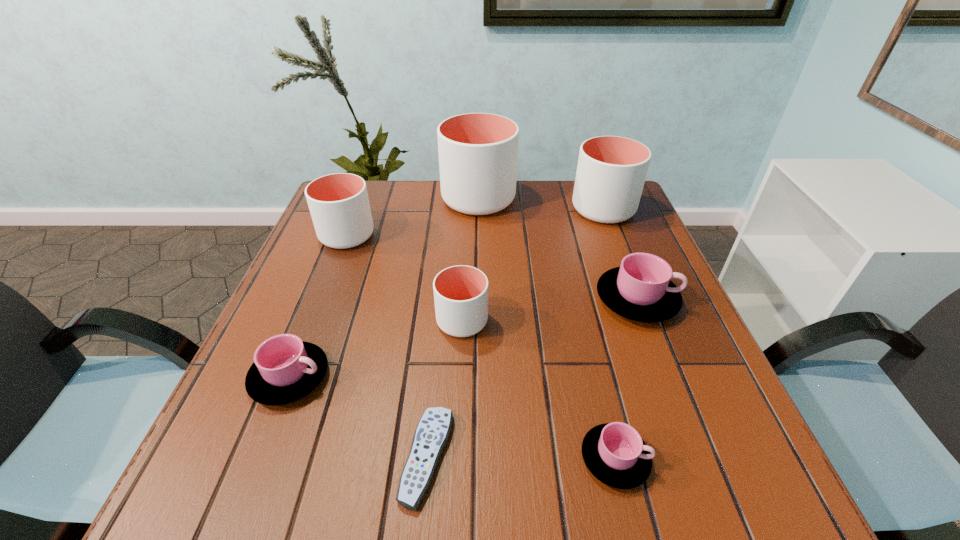
I want to click on free space located 0.080m on the side with the handle of the nearest cup, so click(699, 458).

You are a GUI agent. You are given a task and a screenshot of the screen. Output one action in this format:
    pyautogui.click(x=<x>, y=<y>)
    Task: Click on the free location located 0.260m on the right of the shortest object
    The height and width of the screenshot is (540, 960).
    Given the screenshot: What is the action you would take?
    614,457

Locate an element on the screen. The image size is (960, 540). cup that is at the near edge is located at coordinates (615, 453).

Identify the location of remote control that is at the near edge. (431, 435).

Where is `object located at the far left corner`? Image resolution: width=960 pixels, height=540 pixels. object located at the far left corner is located at coordinates (339, 205).

Where is `object that is at the far right corner`? object that is at the far right corner is located at coordinates (611, 171).

I want to click on free space at the far edge of the desktop, so click(x=431, y=188).

I want to click on vacant area at the near edge, so click(352, 501).

Find the location of `free region at the left edge`. free region at the left edge is located at coordinates (x=293, y=308).

The height and width of the screenshot is (540, 960). Identify the location of vacant region at the right edge of the desktop. (614, 320).